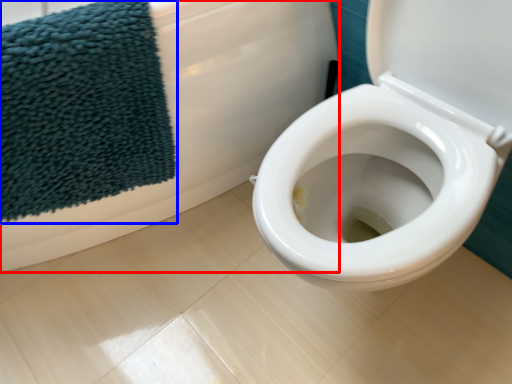
Question: Among these objects, which one is nearest to the camera, bath (highlighted by a red box) or beach towel (highlighted by a blue box)?

Choices:
 (A) bath
 (B) beach towel

Answer: (A)